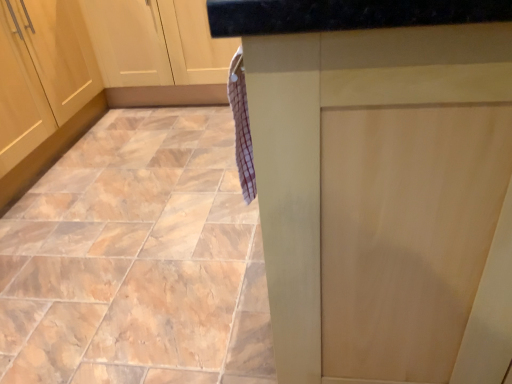
Question: From the image's perspective, is marble-like tile at lower left positioned above or below matte wood counter at center?

Choices:
 (A) below
 (B) above

Answer: (B)

Question: Does point (165, 208) appear closer or farther from the camera than point (509, 243)?

Choices:
 (A) closer
 (B) farther

Answer: (B)

Question: Is marble-like tile at lower left to the left or to the right of matte wood counter at center in the image?

Choices:
 (A) right
 (B) left

Answer: (B)

Question: From the image's perspective, is matte wood counter at center positioned above or below marble-like tile at lower left?

Choices:
 (A) below
 (B) above

Answer: (A)

Question: Would you say matte wood counter at center is inside or outside marble-like tile at lower left?

Choices:
 (A) outside
 (B) inside

Answer: (A)

Question: Based on their positions, is matte wood counter at center located to the left or right of marble-like tile at lower left?

Choices:
 (A) right
 (B) left

Answer: (A)

Question: In terms of height, does matte wood counter at center look taller or shorter compared to marble-like tile at lower left?

Choices:
 (A) short
 (B) tall

Answer: (B)